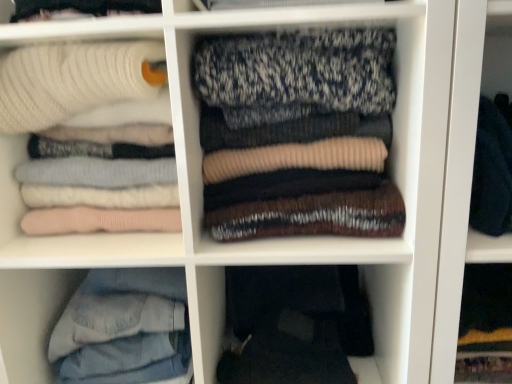
Identify the location of knit sweater at center, which is the second laundry from left to right. The height and width of the screenshot is (384, 512). (298, 133).

Measure the distance between point (232, 308) and camera.

They are 1.01 meters apart.

Where is `white ribbed sweater at upper left, the 2th laundry in the right-to-left sequence`? This screenshot has width=512, height=384. white ribbed sweater at upper left, the 2th laundry in the right-to-left sequence is located at coordinates (78, 86).

Based on their positions, is dark gray fabric pants at lower center located to the left or right of white ribbed sweater at upper left, placed as the 1th laundry when sorted from left to right?

Based on their positions, dark gray fabric pants at lower center is located to the right of white ribbed sweater at upper left, placed as the 1th laundry when sorted from left to right.

In the scene shown: How far apart are dark gray fabric pants at lower center and white ribbed sweater at upper left, placed as the 1th laundry when sorted from left to right?

A distance of 16.56 inches exists between dark gray fabric pants at lower center and white ribbed sweater at upper left, placed as the 1th laundry when sorted from left to right.

Considering the sizes of objects dark gray fabric pants at lower center and white ribbed sweater at upper left, the 2th laundry in the right-to-left sequence, in the image provided, who is shorter, dark gray fabric pants at lower center or white ribbed sweater at upper left, the 2th laundry in the right-to-left sequence,?

dark gray fabric pants at lower center.

Does dark gray fabric pants at lower center have a smaller size compared to white ribbed sweater at upper left, the 2th laundry in the right-to-left sequence?

Yes.

Is knit sweater at center, which is the second laundry from left to right, positioned in front of denim jeans at lower left?

Yes, it is in front of denim jeans at lower left.

How much distance is there between knit sweater at center, the first laundry from the right, and denim jeans at lower left?

knit sweater at center, the first laundry from the right, is 36.95 centimeters away from denim jeans at lower left.

From a real-world perspective, is knit sweater at center, the first laundry from the right, under denim jeans at lower left?

Actually, knit sweater at center, the first laundry from the right, is physically above denim jeans at lower left in the real world.

Consider the image. Which point is more distant from viewer, (50, 228) or (305, 319)?

The point (305, 319) is farther from the camera.

Where is `clothing beneath the white ribbed sweater at upper left, the 2th laundry in the right-to-left sequence (from a real-world perspective)`? The image size is (512, 384). clothing beneath the white ribbed sweater at upper left, the 2th laundry in the right-to-left sequence (from a real-world perspective) is located at coordinates (293, 325).

Considering the positions of objects white ribbed sweater at upper left, the 2th laundry in the right-to-left sequence, and dark gray fabric pants at lower center in the image provided, who is behind, white ribbed sweater at upper left, the 2th laundry in the right-to-left sequence, or dark gray fabric pants at lower center?

dark gray fabric pants at lower center is more distant.

Is white ribbed sweater at upper left, placed as the 1th laundry when sorted from left to right, taller than dark gray fabric pants at lower center?

Indeed, white ribbed sweater at upper left, placed as the 1th laundry when sorted from left to right, has a greater height compared to dark gray fabric pants at lower center.

Does dark gray fabric pants at lower center come in front of knit sweater at center, which is the second laundry from left to right?

That is False.

Choose the correct answer: Is dark gray fabric pants at lower center inside knit sweater at center, the first laundry from the right, or outside it?

dark gray fabric pants at lower center exists outside the volume of knit sweater at center, the first laundry from the right.

Which point is more distant from viewer, (x=339, y=298) or (x=321, y=125)?

The point (x=339, y=298) is behind.

From the image's perspective, count 2nd laundrys upward from the dark gray fabric pants at lower center and point to it. Please provide its 2D coordinates.

[(298, 133)]

Is denim jeans at lower left touching white ribbed sweater at upper left, the 2th laundry in the right-to-left sequence?

No, denim jeans at lower left is not in contact with white ribbed sweater at upper left, the 2th laundry in the right-to-left sequence.

Considering the sizes of objects denim jeans at lower left and white ribbed sweater at upper left, placed as the 1th laundry when sorted from left to right, in the image provided, who is thinner, denim jeans at lower left or white ribbed sweater at upper left, placed as the 1th laundry when sorted from left to right,?

With smaller width is white ribbed sweater at upper left, placed as the 1th laundry when sorted from left to right.

Is denim jeans at lower left not within white ribbed sweater at upper left, placed as the 1th laundry when sorted from left to right?

denim jeans at lower left lies outside white ribbed sweater at upper left, placed as the 1th laundry when sorted from left to right,'s area.

The image size is (512, 384). Identify the location of laundry that is the 1st one when counting upward from the denim jeans at lower left (from the image's perspective). (78, 86).

Does knit sweater at center, the first laundry from the right, have a smaller size compared to dark gray fabric pants at lower center?

No.

From the image's perspective, which one is positioned lower, knit sweater at center, the first laundry from the right, or dark gray fabric pants at lower center?

dark gray fabric pants at lower center, from the image's perspective.

Considering the positions of objects knit sweater at center, which is the second laundry from left to right, and dark gray fabric pants at lower center in the image provided, who is more to the left, knit sweater at center, which is the second laundry from left to right, or dark gray fabric pants at lower center?

Positioned to the left is knit sweater at center, which is the second laundry from left to right.

Based on the photo, is denim jeans at lower left located within white ribbed sweater at upper left, the 2th laundry in the right-to-left sequence?

No, denim jeans at lower left is not surrounded by white ribbed sweater at upper left, the 2th laundry in the right-to-left sequence.

From a real-world perspective, between white ribbed sweater at upper left, the 2th laundry in the right-to-left sequence, and denim jeans at lower left, who is vertically higher?

white ribbed sweater at upper left, the 2th laundry in the right-to-left sequence, from a real-world perspective.

In terms of height, does white ribbed sweater at upper left, the 2th laundry in the right-to-left sequence, look taller or shorter compared to denim jeans at lower left?

white ribbed sweater at upper left, the 2th laundry in the right-to-left sequence, is taller than denim jeans at lower left.

Does white ribbed sweater at upper left, the 2th laundry in the right-to-left sequence, appear on the left side of denim jeans at lower left?

Indeed, white ribbed sweater at upper left, the 2th laundry in the right-to-left sequence, is positioned on the left side of denim jeans at lower left.

Find the location of a particular element. This screenshot has width=512, height=384. clothing that is under the white ribbed sweater at upper left, placed as the 1th laundry when sorted from left to right (from a real-world perspective) is located at coordinates (293, 325).

This screenshot has width=512, height=384. In order to click on trousers below the knit sweater at center, which is the second laundry from left to right (from the image's perspective) in this screenshot , I will do `click(124, 329)`.

When comparing their distances from white ribbed sweater at upper left, placed as the 1th laundry when sorted from left to right, does knit sweater at center, the first laundry from the right, or dark gray fabric pants at lower center seem further?

dark gray fabric pants at lower center.

Based on their spatial positions, is white ribbed sweater at upper left, the 2th laundry in the right-to-left sequence, or knit sweater at center, which is the second laundry from left to right, closer to denim jeans at lower left?

The object closer to denim jeans at lower left is white ribbed sweater at upper left, the 2th laundry in the right-to-left sequence.

Considering their positions, is knit sweater at center, which is the second laundry from left to right, positioned closer to white ribbed sweater at upper left, placed as the 1th laundry when sorted from left to right, than denim jeans at lower left?

Based on the image, knit sweater at center, which is the second laundry from left to right, appears to be nearer to white ribbed sweater at upper left, placed as the 1th laundry when sorted from left to right.

From the image, which object appears to be nearer to dark gray fabric pants at lower center, knit sweater at center, which is the second laundry from left to right, or white ribbed sweater at upper left, placed as the 1th laundry when sorted from left to right?

Among the two, knit sweater at center, which is the second laundry from left to right, is located nearer to dark gray fabric pants at lower center.

Which object lies further to the anchor point knit sweater at center, which is the second laundry from left to right, white ribbed sweater at upper left, the 2th laundry in the right-to-left sequence, or denim jeans at lower left?

The object further to knit sweater at center, which is the second laundry from left to right, is denim jeans at lower left.

From the image, which object appears to be nearer to white ribbed sweater at upper left, placed as the 1th laundry when sorted from left to right, dark gray fabric pants at lower center or denim jeans at lower left?

denim jeans at lower left is closer to white ribbed sweater at upper left, placed as the 1th laundry when sorted from left to right.

Looking at the image, which one is located closer to white ribbed sweater at upper left, placed as the 1th laundry when sorted from left to right, denim jeans at lower left or dark gray fabric pants at lower center?

denim jeans at lower left lies closer to white ribbed sweater at upper left, placed as the 1th laundry when sorted from left to right, than the other object.

Estimate the real-world distances between objects in this image. Which object is further from denim jeans at lower left, dark gray fabric pants at lower center or knit sweater at center, which is the second laundry from left to right?

The object further to denim jeans at lower left is knit sweater at center, which is the second laundry from left to right.

Where is `trousers between white ribbed sweater at upper left, placed as the 1th laundry when sorted from left to right, and dark gray fabric pants at lower center vertically`? Image resolution: width=512 pixels, height=384 pixels. trousers between white ribbed sweater at upper left, placed as the 1th laundry when sorted from left to right, and dark gray fabric pants at lower center vertically is located at coordinates (124, 329).

Image resolution: width=512 pixels, height=384 pixels. What are the coordinates of `laundry between knit sweater at center, the first laundry from the right, and denim jeans at lower left vertically` in the screenshot? It's located at (78, 86).

The width and height of the screenshot is (512, 384). I want to click on laundry between knit sweater at center, which is the second laundry from left to right, and dark gray fabric pants at lower center vertically, so click(78, 86).

Locate an element on the screen. trousers between knit sweater at center, the first laundry from the right, and dark gray fabric pants at lower center vertically is located at coordinates (124, 329).